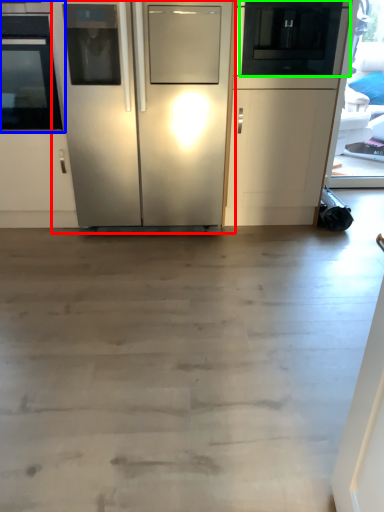
Question: Which object is the farthest from refrigerator (highlighted by a red box)? Choose among these: oven (highlighted by a blue box) or appliance (highlighted by a green box).

Choices:
 (A) oven
 (B) appliance

Answer: (B)